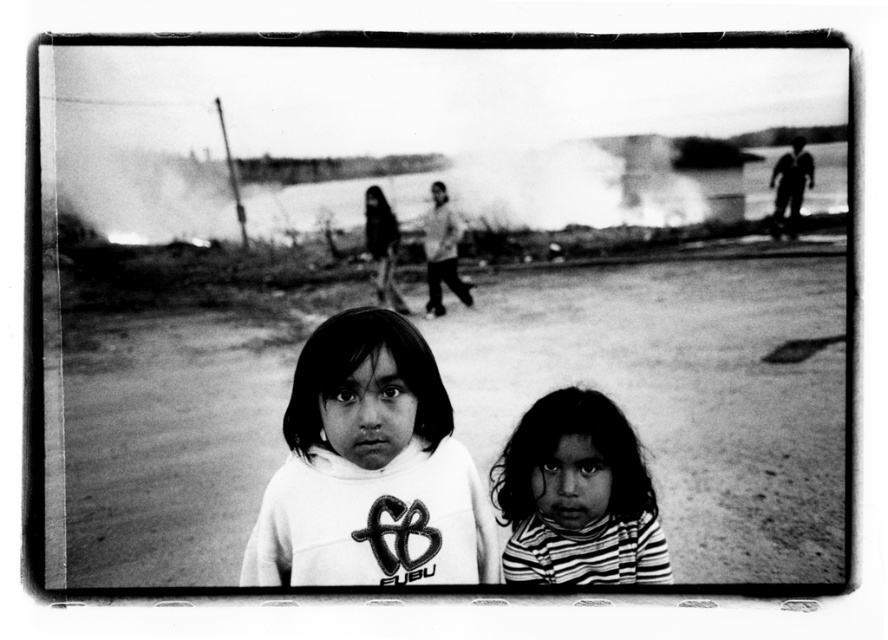
Is white soft sweatshirt at center below striped fabric shirt at lower right?

No, white soft sweatshirt at center is not below striped fabric shirt at lower right.

Is point (382, 561) less distant than point (611, 531)?

Yes.

Image resolution: width=888 pixels, height=640 pixels. What do you see at coordinates (370, 468) in the screenshot? I see `white soft sweatshirt at center` at bounding box center [370, 468].

The height and width of the screenshot is (640, 888). Find the location of `white soft sweatshirt at center`. white soft sweatshirt at center is located at coordinates (370, 468).